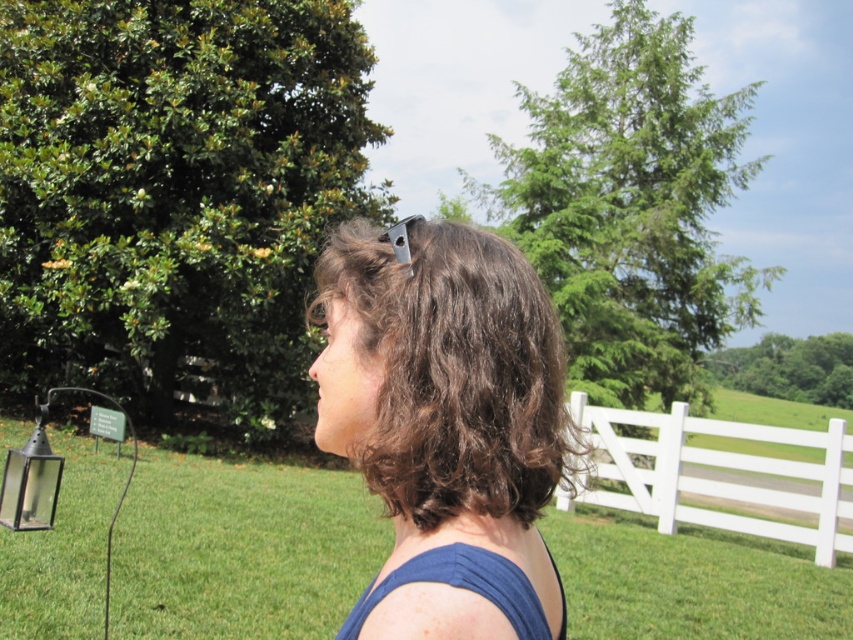
Question: Can you confirm if green grass at center is bigger than white wooden fence at right?

Choices:
 (A) yes
 (B) no

Answer: (A)

Question: Based on their relative distances, which object is farther from the dark brown hair at center?

Choices:
 (A) green leafy tree at right
 (B) white wooden fence at right
 (C) black glass lantern at left

Answer: (A)

Question: Considering the relative positions of white wooden fence at right and green leafy tree at right in the image provided, where is white wooden fence at right located with respect to green leafy tree at right?

Choices:
 (A) left
 (B) right

Answer: (A)

Question: Considering the real-world distances, which object is closest to the green leafy tree at right?

Choices:
 (A) green grass at center
 (B) green leafy tree at upper center
 (C) white wooden fence at right
 (D) black glass lantern at left

Answer: (B)

Question: Which is farther from the green leafy tree at upper center?

Choices:
 (A) green grass at center
 (B) green leafy tree at right
 (C) green leafy tree at upper left
 (D) white wooden fence at right

Answer: (C)

Question: Does dark brown hair at center have a greater width compared to green leafy tree at right?

Choices:
 (A) yes
 (B) no

Answer: (B)